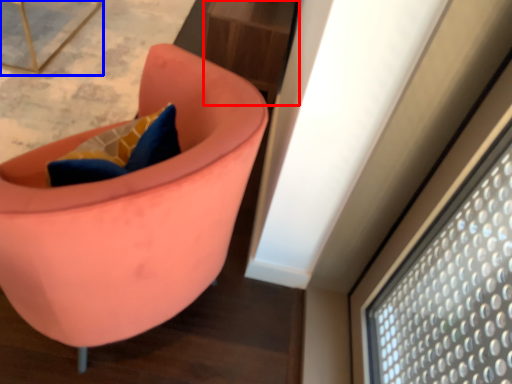
Question: Which point is further to the camera, table (highlighted by a red box) or furniture (highlighted by a blue box)?

Choices:
 (A) table
 (B) furniture

Answer: (A)